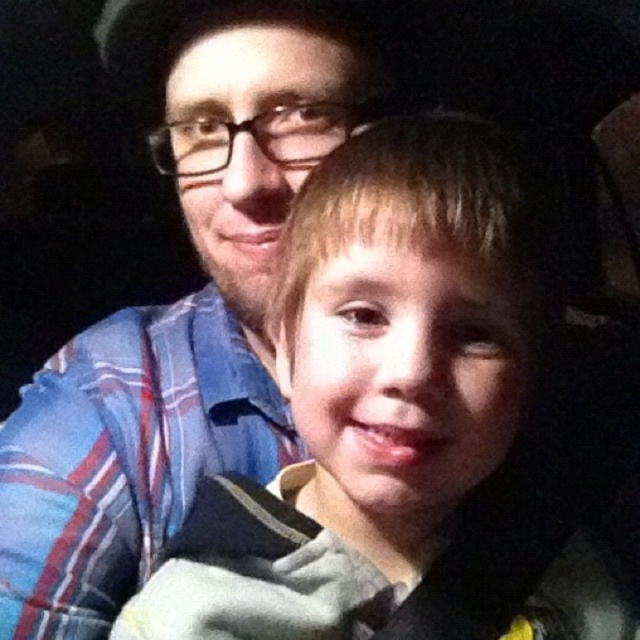
You are a photographer trying to capture a portrait of the smooth tan skin at center and the blue plaid shirt at upper left in the image. The camera has a depth of field that can focus on objects within 6 inches of each other. Will both subjects be in focus?

The smooth tan skin at center and blue plaid shirt at upper left are 6.52 inches apart, which exceeds the camera depth of field limit of 6 inches. Therefore, both subjects cannot be in focus simultaneously.

Based on the scene description, where is the smooth tan skin at center positioned in relation to the man and the child?

The smooth tan skin at center is located at point (408, 420), which is likely part of either the man or the child in the image.

Based on the scene description, what is located at the coordinates point [408,420]?

The point [408,420] has smooth tan skin at center.